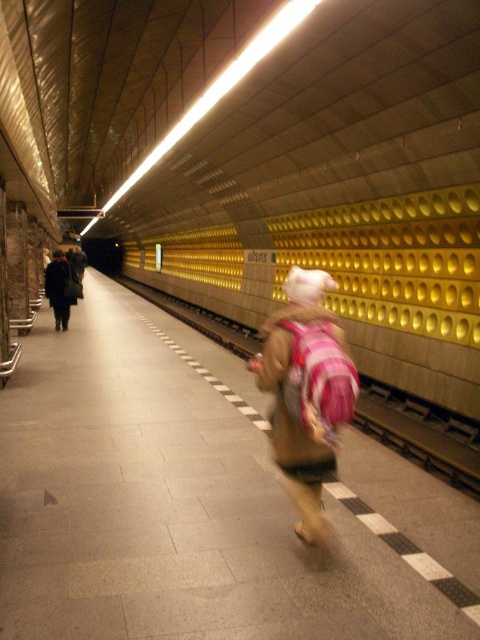
You are a delivery person carrying a large box that requires a 10 feet clearance to move around. You are on the subway platform and see the brown fuzzy coat at center and the dark wool coat at left. Is there enough space between them to maneuver your box?

The distance between the brown fuzzy coat at center and the dark wool coat at left is 36.42 feet, which is more than enough space for the delivery person to maneuver a box requiring 10 feet of clearance.

You are standing on the subway platform and see a person wearing a brown fuzzy coat at center and another wearing a dark wool coat at left. Which coat is closer to you?

The brown fuzzy coat at center is closer to you because it is in front of the dark wool coat at left.

You are a pedestrian waiting for the subway. You see a brown fuzzy coat at center and a dark wool coat at left. Which coat is closer to you?

The brown fuzzy coat at center is closer to you because it is positioned under the dark wool coat at left, indicating it is in front.